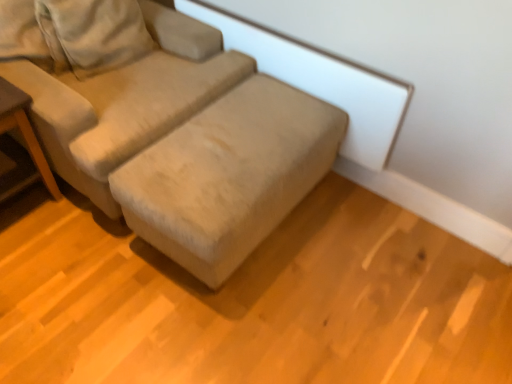
Locate an element on the screen. Image resolution: width=512 pixels, height=384 pixels. wooden table at left is located at coordinates (24, 130).

Describe the element at coordinates (24, 130) in the screenshot. The height and width of the screenshot is (384, 512). I see `wooden table at left` at that location.

In order to face beige fabric couch at center, should I rotate leftwards or rightwards?

To face it directly, rotate left by 19.466 degrees.

This screenshot has height=384, width=512. What do you see at coordinates (185, 141) in the screenshot?
I see `beige fabric couch at center` at bounding box center [185, 141].

Image resolution: width=512 pixels, height=384 pixels. I want to click on beige fabric couch at center, so click(185, 141).

Identify the location of wooden table at left. The height and width of the screenshot is (384, 512). (24, 130).

From the picture: Is beige fabric couch at center at the right side of wooden table at left?

Yes.

Is beige fabric couch at center positioned behind wooden table at left?

No, beige fabric couch at center is closer to the camera.

Does point (116, 78) appear closer or farther from the camera than point (31, 146)?

Point (116, 78).

From the image's perspective, which is above, beige fabric couch at center or wooden table at left?

beige fabric couch at center is shown above in the image.

From a real-world perspective, which is physically below, beige fabric couch at center or wooden table at left?

wooden table at left is physically lower.

In terms of width, does beige fabric couch at center look wider or thinner when compared to wooden table at left?

Clearly, beige fabric couch at center has more width compared to wooden table at left.

Considering the relative sizes of beige fabric couch at center and wooden table at left in the image provided, is beige fabric couch at center taller than wooden table at left?

Yes, beige fabric couch at center is taller than wooden table at left.

Is beige fabric couch at center smaller than wooden table at left?

No.

Choose the correct answer: Is beige fabric couch at center inside wooden table at left or outside it?

beige fabric couch at center is outside wooden table at left.

Does beige fabric couch at center touch wooden table at left?

There is a gap between beige fabric couch at center and wooden table at left.

Is beige fabric couch at center turned away from wooden table at left?

No, beige fabric couch at center is not facing the opposite direction of wooden table at left.

What's the angular difference between beige fabric couch at center and wooden table at left's facing directions?

beige fabric couch at center and wooden table at left are facing 1.61 degrees away from each other.

The width and height of the screenshot is (512, 384). Identify the location of table below the beige fabric couch at center (from the image's perspective). (24, 130).

Visually, is wooden table at left positioned to the left or to the right of beige fabric couch at center?

wooden table at left is to the left of beige fabric couch at center.

Is wooden table at left in front of beige fabric couch at center?

No, wooden table at left is further to the viewer.

Which point is more forward, (35, 164) or (90, 123)?

The point (90, 123) is closer to the camera.

From the image's perspective, is wooden table at left under beige fabric couch at center?

Yes, from the image's perspective, wooden table at left is below beige fabric couch at center.

Looking at this image, from a real-world perspective, is wooden table at left physically above beige fabric couch at center?

No, from a real-world perspective, wooden table at left is not over beige fabric couch at center

Which object is thinner, wooden table at left or beige fabric couch at center?

With smaller width is wooden table at left.

Considering the relative sizes of wooden table at left and beige fabric couch at center in the image provided, is wooden table at left taller than beige fabric couch at center?

Incorrect, the height of wooden table at left is not larger of that of beige fabric couch at center.

Who is bigger, wooden table at left or beige fabric couch at center?

beige fabric couch at center.

In the scene shown: Is wooden table at left inside or outside of beige fabric couch at center?

wooden table at left is spatially situated outside beige fabric couch at center.

Is wooden table at left directly adjacent to beige fabric couch at center?

No, wooden table at left is not in contact with beige fabric couch at center.

Is wooden table at left facing away from beige fabric couch at center?

wooden table at left does not have its back to beige fabric couch at center.

Image resolution: width=512 pixels, height=384 pixels. I want to click on table below the beige fabric couch at center (from a real-world perspective), so click(24, 130).

You are a GUI agent. You are given a task and a screenshot of the screen. Output one action in this format:
    pyautogui.click(x=<x>, y=<y>)
    Task: Click on the table that appears behind the beige fabric couch at center
    The image size is (512, 384).
    Given the screenshot: What is the action you would take?
    pyautogui.click(x=24, y=130)

Locate an element on the screen. The width and height of the screenshot is (512, 384). studio couch in front of the wooden table at left is located at coordinates (185, 141).